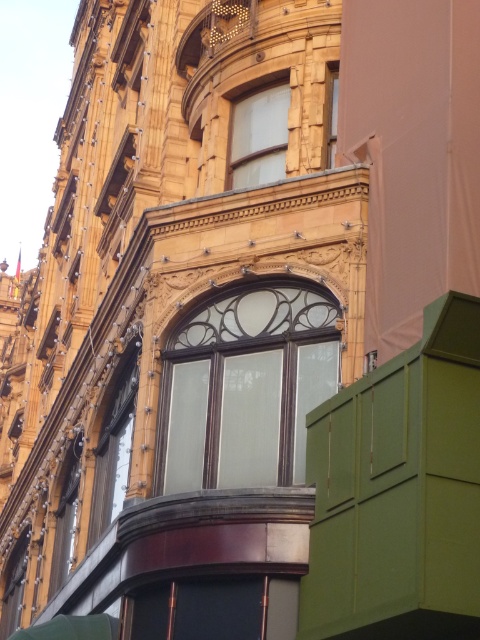
Question: Which is nearer to the matte glass window at center?

Choices:
 (A) matte glass window at lower left
 (B) matte glass window at upper left

Answer: (B)

Question: Which point is closer to the camera taking this photo?

Choices:
 (A) (56, 532)
 (B) (332, 92)

Answer: (B)

Question: Is matte glass window at center wider than translucent glass window at upper center?

Choices:
 (A) no
 (B) yes

Answer: (B)

Question: From the image, what is the correct spatial relationship of matte glass window at upper left in relation to clear glass window at upper center?

Choices:
 (A) left
 (B) right

Answer: (A)

Question: Among these objects, which one is nearest to the camera?

Choices:
 (A) matte glass window at upper left
 (B) matte glass window at lower left

Answer: (A)

Question: Does matte glass window at lower left have a smaller size compared to clear glass window at upper center?

Choices:
 (A) no
 (B) yes

Answer: (A)